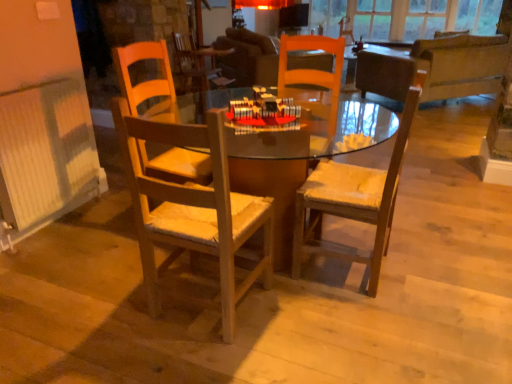
Locate an element on the screen. vacant area situated below white ribbed radiator at left (from a real-world perspective) is located at coordinates [x=56, y=220].